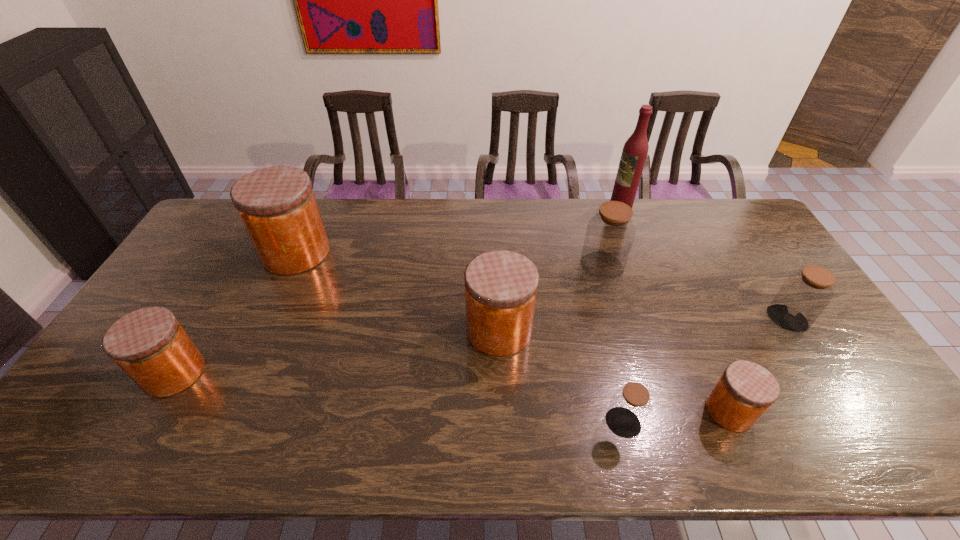
Find the location of a particular element. Image resolution: width=960 pixels, height=540 pixels. vacant area between the nearest brown jar and the rightmost orange jar is located at coordinates (676, 417).

Locate which object ranks in proximity to the second smallest brown jar. Please provide its 2D coordinates. Your answer should be formatted as a tuple, i.e. [(x, y)], where the tuple contains the x and y coordinates of a point satisfying the conditions above.

[(745, 391)]

The width and height of the screenshot is (960, 540). In order to click on the seventh closest object to the biggest brown jar in this screenshot , I will do (149, 344).

Identify which jar is located as the fourth nearest to the smallest brown jar. Please provide its 2D coordinates. Your answer should be formatted as a tuple, i.e. [(x, y)], where the tuple contains the x and y coordinates of a point satisfying the conditions above.

[(803, 296)]

Point out which jar is positioned as the third nearest to the nearest brown jar. Please provide its 2D coordinates. Your answer should be formatted as a tuple, i.e. [(x, y)], where the tuple contains the x and y coordinates of a point satisfying the conditions above.

[(610, 233)]

Identify which orange jar is the third nearest to the smallest orange jar. Please provide its 2D coordinates. Your answer should be formatted as a tuple, i.e. [(x, y)], where the tuple contains the x and y coordinates of a point satisfying the conditions above.

[(149, 344)]

Identify which orange jar is located as the second nearest to the smallest brown jar. Please provide its 2D coordinates. Your answer should be formatted as a tuple, i.e. [(x, y)], where the tuple contains the x and y coordinates of a point satisfying the conditions above.

[(501, 286)]

Identify the location of brown jar that is the closest to the biggest brown jar. The image size is (960, 540). (803, 296).

Identify which brown jar is located as the nearest to the biggest brown jar. Please provide its 2D coordinates. Your answer should be formatted as a tuple, i.e. [(x, y)], where the tuple contains the x and y coordinates of a point satisfying the conditions above.

[(803, 296)]

Identify the location of vacant space that satisfies the following two spatial constraints: 1. on the front side of the second jar from right to left; 2. on the right side of the farthest brown jar. (642, 411).